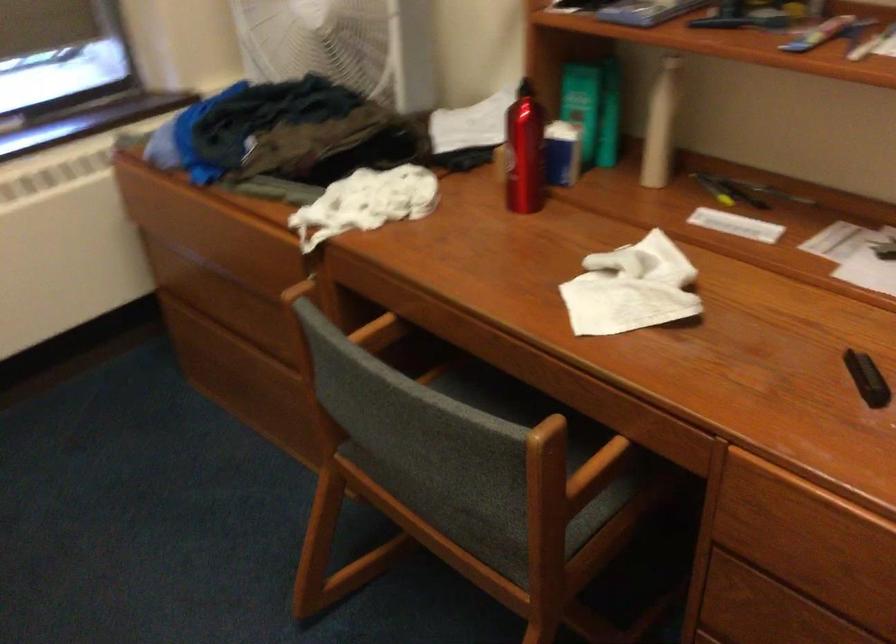
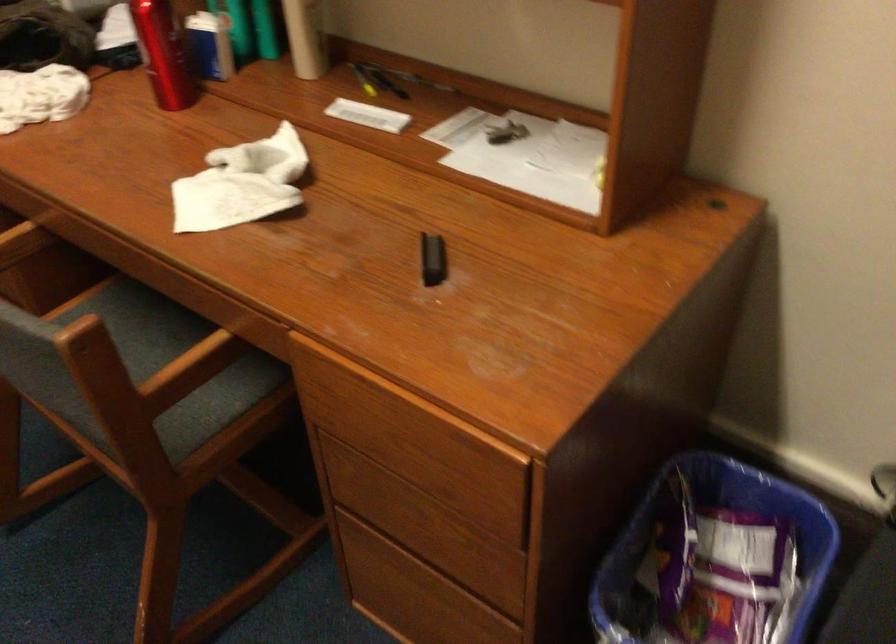
Question: In a continuous first-person perspective shot, in which direction is the camera moving?

Choices:
 (A) Left
 (B) Right
 (C) Forward
 (D) Backward

Answer: (B)